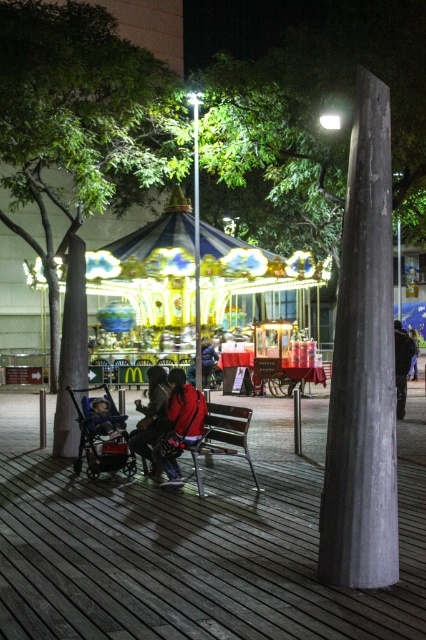
Question: Is matte black stroller at lower left wider than blue denim jacket at center?

Choices:
 (A) no
 (B) yes

Answer: (B)

Question: Which point appears farthest from the camera in this image?

Choices:
 (A) (108, 412)
 (B) (155, 467)

Answer: (B)

Question: Which is nearer to the matte red jacket at center?

Choices:
 (A) green leafy tree at left
 (B) smooth gray pole at center

Answer: (B)

Question: Can you confirm if dark gray plastic baby carriage at center-left is positioned above blue denim jacket at center?

Choices:
 (A) yes
 (B) no

Answer: (B)

Question: Is smooth gray pole at center wider than blue denim jacket at center?

Choices:
 (A) no
 (B) yes

Answer: (B)

Question: Which of the following is the closest to the observer?

Choices:
 (A) matte black stroller at lower left
 (B) dark brown leather jacket at center

Answer: (B)